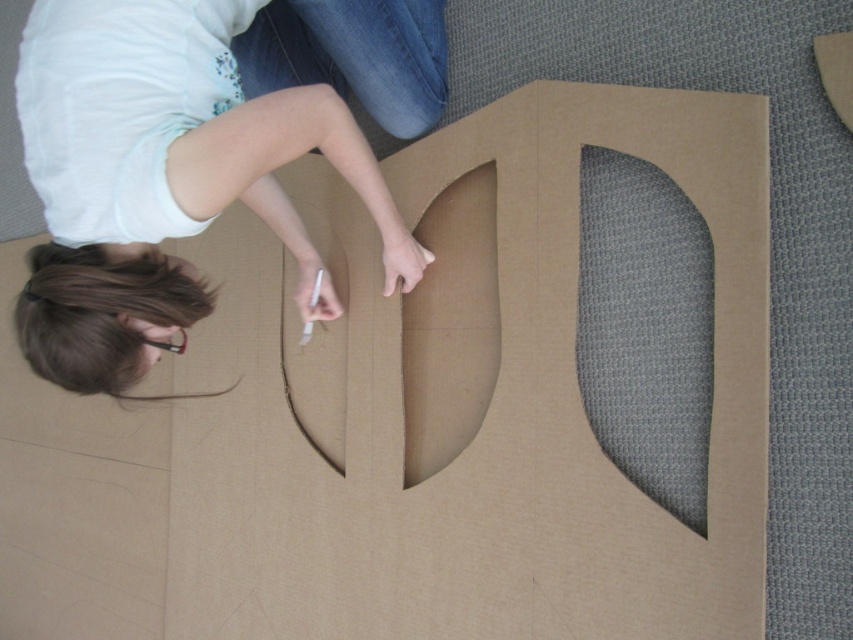
Which is more to the left, brown cardboard at center or matte brown hair at upper left?

matte brown hair at upper left is more to the left.

Can you confirm if brown cardboard at center is positioned below matte brown hair at upper left?

Correct, brown cardboard at center is located below matte brown hair at upper left.

In order to click on brown cardboard at center in this screenshot , I will do `click(485, 416)`.